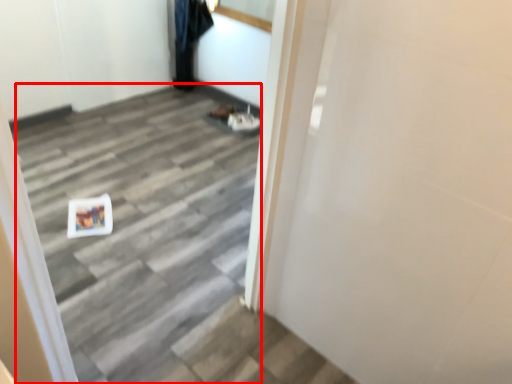
Question: From the image's perspective, what is the correct spatial relationship of stairwell (annotated by the red box) in relation to garment?

Choices:
 (A) below
 (B) above

Answer: (A)